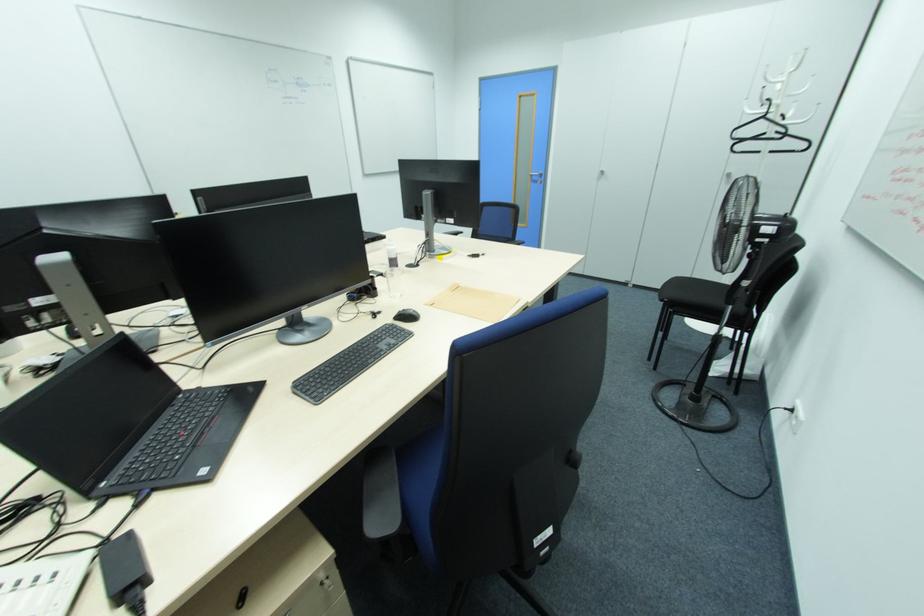
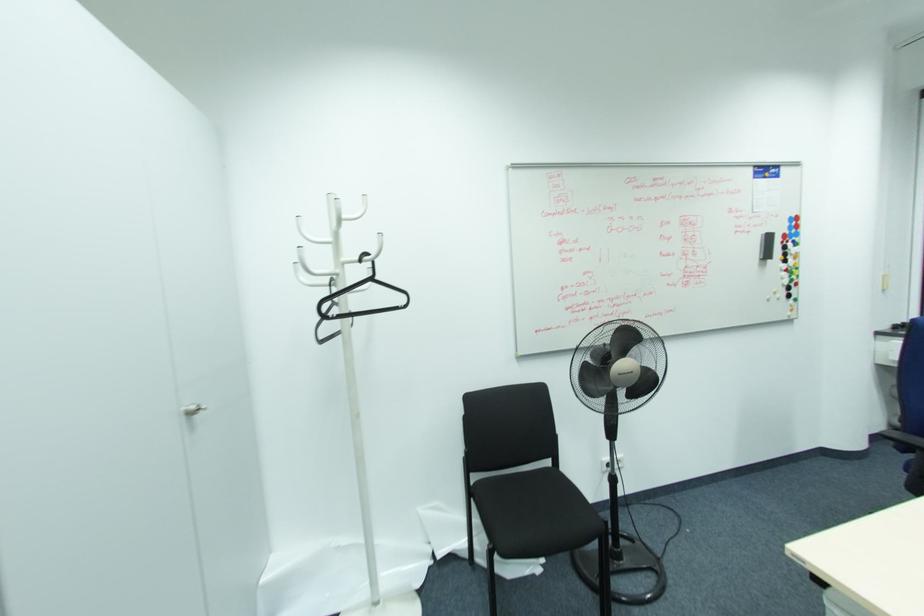
Locate, in the second image, the point that corresponds to pixel 764 118 in the first image.

(371, 280)